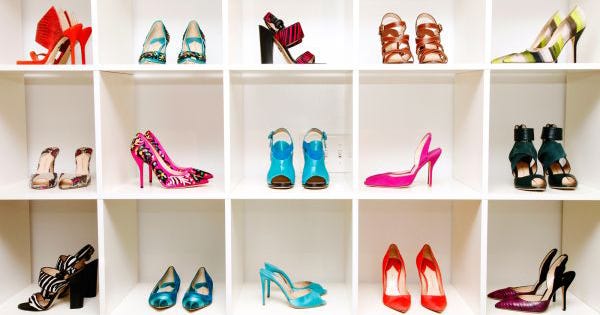
The height and width of the screenshot is (315, 600). Find the location of `shoes on middle shelf`. shoes on middle shelf is located at coordinates (48, 168), (69, 178), (150, 162), (165, 158), (279, 167), (313, 167), (383, 178), (523, 150), (553, 164).